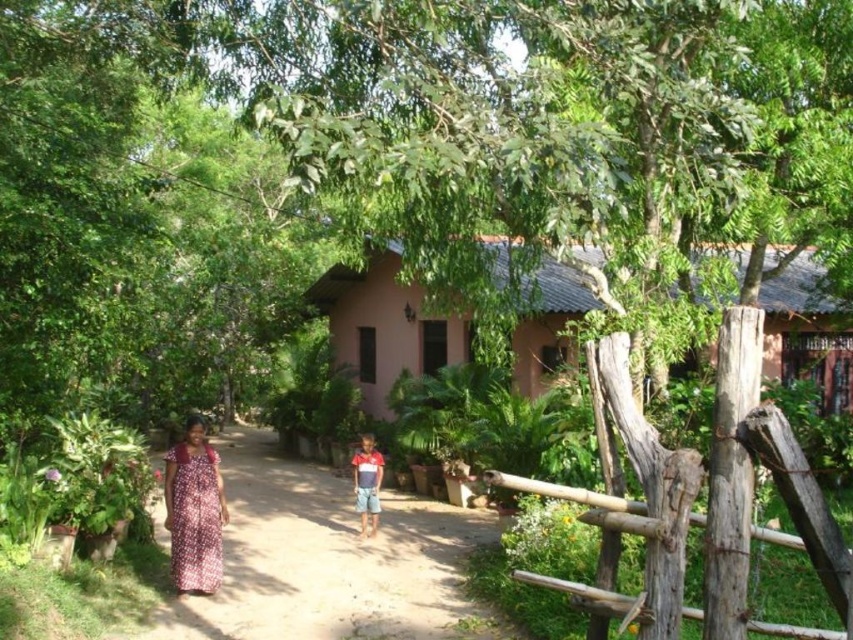
Question: Considering the real-world distances, which object is closest to the pink clay hut at center?

Choices:
 (A) brown dirt path at center
 (B) red striped shirt at center

Answer: (A)

Question: Does brown dirt path at center have a smaller size compared to printed cotton dress at lower left?

Choices:
 (A) yes
 (B) no

Answer: (B)

Question: Can you confirm if printed cotton dress at lower left is positioned to the right of red striped shirt at center?

Choices:
 (A) yes
 (B) no

Answer: (B)

Question: Which object appears farthest from the camera in this image?

Choices:
 (A) red striped shirt at center
 (B) pink clay hut at center
 (C) printed cotton dress at lower left

Answer: (A)

Question: Considering the real-world distances, which object is closest to the red striped shirt at center?

Choices:
 (A) pink clay hut at center
 (B) printed cotton dress at lower left

Answer: (B)

Question: Is brown dirt path at center to the left of red striped shirt at center from the viewer's perspective?

Choices:
 (A) yes
 (B) no

Answer: (A)